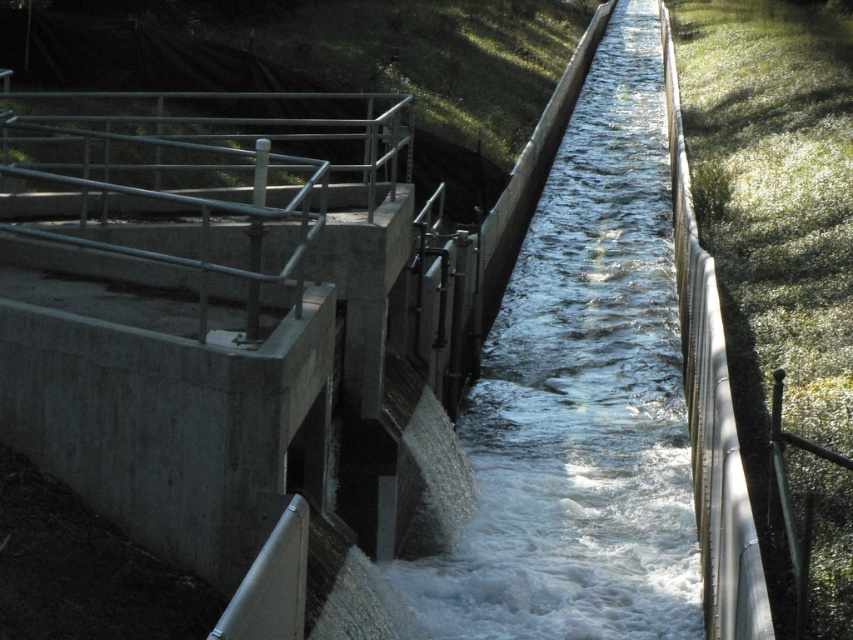
Question: Which point is farther from the camera taking this photo?

Choices:
 (A) (712, 273)
 (B) (669, 310)

Answer: (B)

Question: Which point is closer to the camera taking this photo?

Choices:
 (A) (669, 449)
 (B) (770, 634)

Answer: (B)

Question: Which point is closer to the camera taking this photo?

Choices:
 (A) (699, 257)
 (B) (596, 246)

Answer: (A)

Question: Does clear water at center appear on the left side of metallic silver rail at right?

Choices:
 (A) no
 (B) yes

Answer: (B)

Question: Considering the relative positions of clear water at center and metallic silver rail at right in the image provided, where is clear water at center located with respect to metallic silver rail at right?

Choices:
 (A) left
 (B) right

Answer: (A)

Question: Can you confirm if clear water at center is bigger than metallic silver rail at right?

Choices:
 (A) no
 (B) yes

Answer: (B)